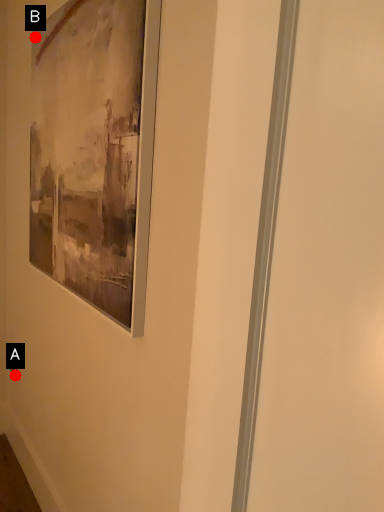
Question: Two points are circled on the image, labeled by A and B beside each circle. Among these points, which one is nearest to the camera?

Choices:
 (A) A is closer
 (B) B is closer

Answer: (B)